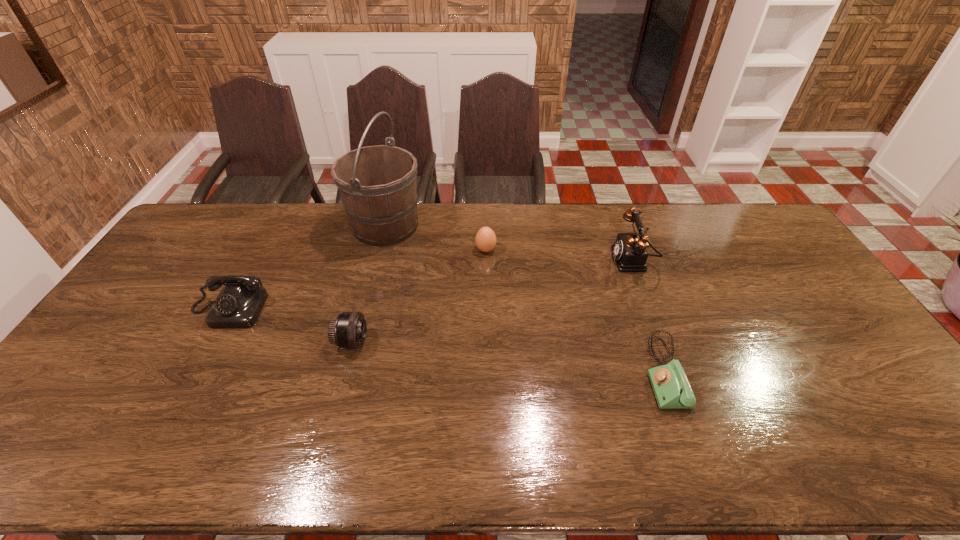
Identify the location of the tallest object. The height and width of the screenshot is (540, 960). (378, 185).

Image resolution: width=960 pixels, height=540 pixels. Find the location of `the farthest telephone`. the farthest telephone is located at coordinates (629, 250).

Locate an element on the screen. the tallest telephone is located at coordinates (629, 250).

Locate an element on the screen. The width and height of the screenshot is (960, 540). the leftmost telephone is located at coordinates pyautogui.click(x=238, y=305).

The width and height of the screenshot is (960, 540). What are the coordinates of `the second farthest telephone` in the screenshot? It's located at (238, 305).

In order to click on telephoto lens in this screenshot , I will do `click(347, 331)`.

Locate an element on the screen. Image resolution: width=960 pixels, height=540 pixels. boiled egg is located at coordinates (485, 240).

Where is `the shortest object`? This screenshot has width=960, height=540. the shortest object is located at coordinates (672, 390).

This screenshot has width=960, height=540. Identify the location of the nearest telephone. (672, 390).

Locate an element on the screen. This screenshot has height=540, width=960. blank space located 0.180m on the front of the tallest object is located at coordinates (370, 290).